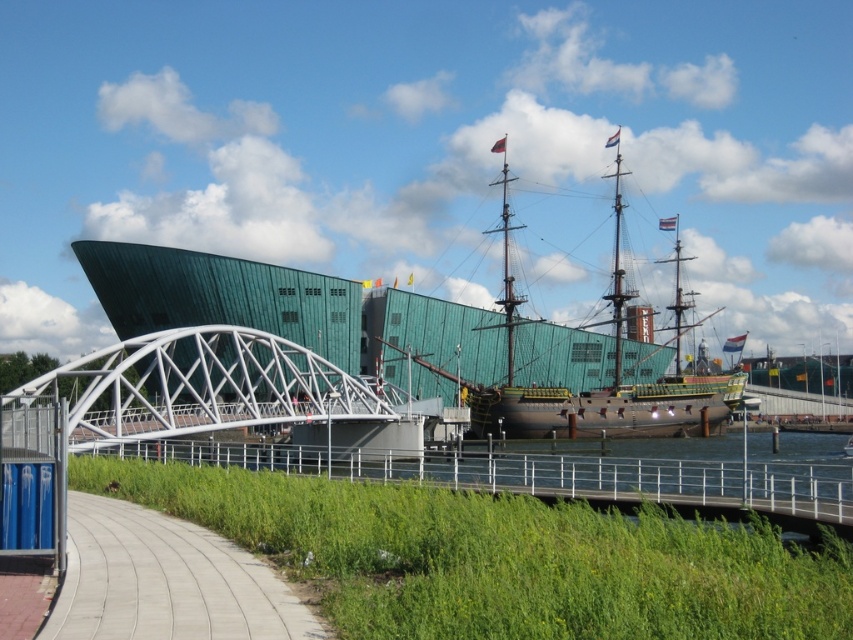
Is white metallic bridge at center shorter than concrete sidewalk at lower left?

No, white metallic bridge at center is not shorter than concrete sidewalk at lower left.

Describe the element at coordinates (202, 387) in the screenshot. I see `white metallic bridge at center` at that location.

Which is in front, point (321, 408) or point (177, 627)?

Point (177, 627) is more forward.

Find the location of `white metallic bridge at center`. white metallic bridge at center is located at coordinates (202, 387).

Between concrete sidewalk at lower left and brown wooden ship at center, which one appears on the left side from the viewer's perspective?

Positioned to the left is concrete sidewalk at lower left.

Is concrete sidewalk at lower left below brown wooden ship at center?

Indeed, concrete sidewalk at lower left is positioned under brown wooden ship at center.

Where is `concrete sidewalk at lower left`? Image resolution: width=853 pixels, height=640 pixels. concrete sidewalk at lower left is located at coordinates (165, 580).

Where is `concrete sidewalk at lower left`? The width and height of the screenshot is (853, 640). concrete sidewalk at lower left is located at coordinates (165, 580).

Is white metallic bridge at center positioned behind brown wooden ship at center?

No, it is not.

Who is taller, white metallic bridge at center or brown wooden ship at center?

brown wooden ship at center is taller.

Is point (248, 396) behind point (543, 426)?

No, (248, 396) is closer to viewer.

This screenshot has height=640, width=853. In order to click on white metallic bridge at center in this screenshot , I will do `click(202, 387)`.